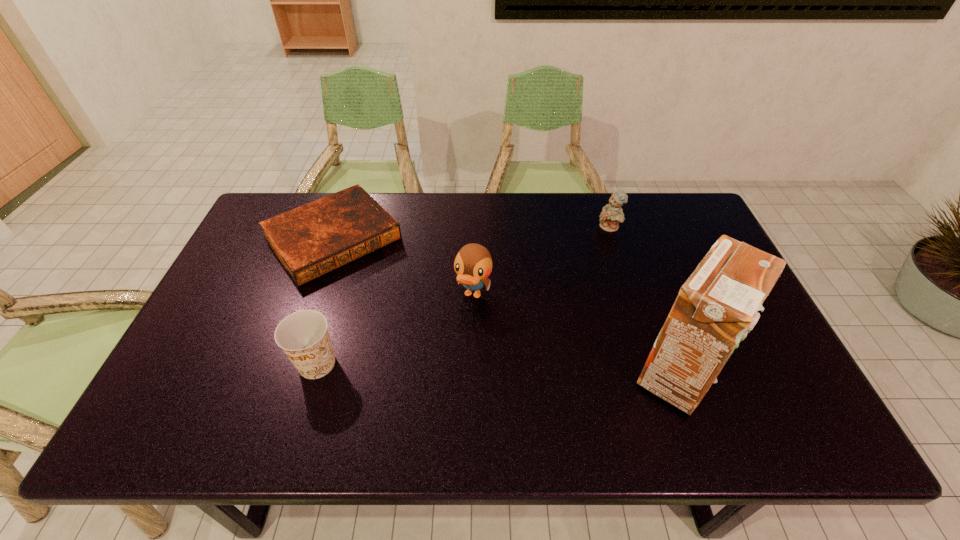
You are a GUI agent. You are given a task and a screenshot of the screen. Output one action in this format:
    pyautogui.click(x=<x>, y=<y>)
    Task: Click on the Dixie cup
    
    Given the screenshot: What is the action you would take?
    pyautogui.click(x=303, y=335)

You are a GUI agent. You are given a task and a screenshot of the screen. Output one action in this format:
    pyautogui.click(x=<x>, y=<y>)
    Task: Click on the tallest object
    This screenshot has width=960, height=540.
    Given the screenshot: What is the action you would take?
    pyautogui.click(x=718, y=303)

Locate an element on the screen. teddy bear is located at coordinates (612, 214).

In order to click on the shortest object in this screenshot , I will do `click(316, 238)`.

Locate an element on the screen. This screenshot has height=540, width=960. the third object from left to right is located at coordinates (473, 264).

Identify the location of the second tallest object. (473, 264).

Locate an element on the screen. free space located on the back of the Dixie cup is located at coordinates (342, 281).

Locate an element on the screen. The width and height of the screenshot is (960, 540). free region located on the straw side of the carton is located at coordinates (776, 375).

Identify the location of free spot located on the front-facing side of the teddy bear. (549, 306).

At what (x,y) coordinates should I click in order to perform the action: click on free space located on the front-facing side of the teddy bear. Please return your answer as a coordinate pair (x, y). This screenshot has height=540, width=960. Looking at the image, I should click on (545, 310).